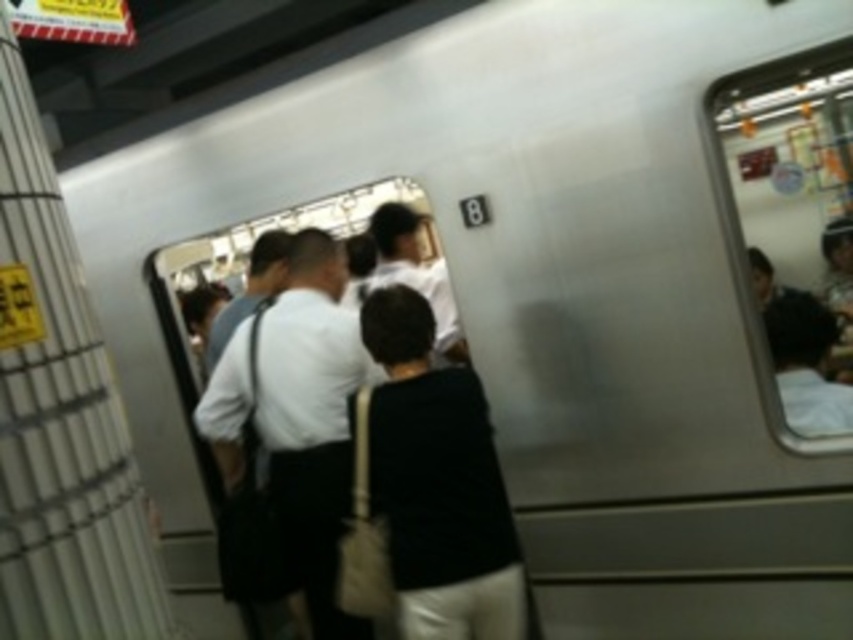
You are a passenger waiting to board the train. You notice a black fabric bag at center and a white matte shirt at center. Which item is nearer to you as you wait on the platform?

The black fabric bag at center is closer to the viewer than the white matte shirt at center.

You are a commuter trying to board the train. You notice a black fabric bag at center and a white matte shirt at center. Which item is closer to the right side of the platform?

The black fabric bag at center is to the right of the white matte shirt at center, so it is closer to the right side of the platform.

You are a commuter trying to board the train. You notice a black fabric bag at center and a white matte shirt at center near the entrance. Which item is narrower in width?

The black fabric bag at center is thinner than the white matte shirt at center, so the black fabric bag at center is narrower in width.